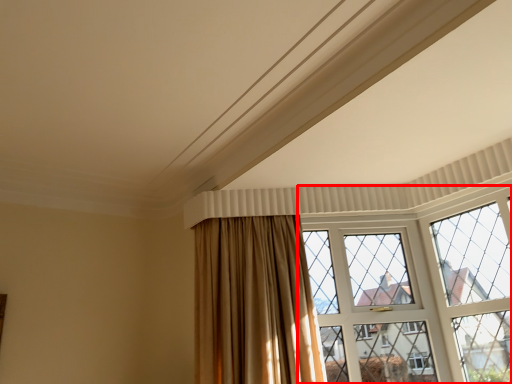
Question: Observing the image, what is the correct spatial positioning of window (annotated by the red box) in reference to curtain?

Choices:
 (A) right
 (B) left

Answer: (A)